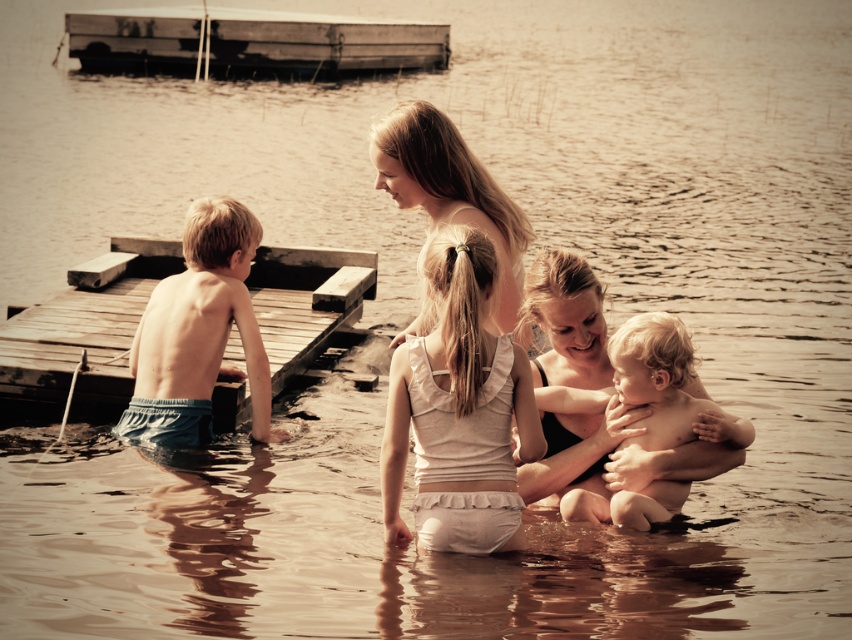
You are a photographer standing at the edge of the lake. You want to take a photo that includes both the blue denim shorts at left and the wooden raft at upper left. Given that your camera has a maximum zoom range of 30 meters, will you be able to capture both objects in the same frame without moving closer?

The blue denim shorts at left and the wooden raft at upper left are 40.17 meters apart from each other. Since the camera can only zoom up to 30 meters, it won not be able to capture both objects in the same frame without moving closer.

You are a photographer trying to capture the blue denim shorts at left and the wooden raft at upper left in the same frame. Based on their positions, which object should you adjust your camera to focus on first to ensure both are in the shot?

The blue denim shorts at left are to the right of the wooden raft at upper left, so you should focus on the wooden raft at upper left first to ensure both are in the frame.

You are a photographer trying to capture the wooden dock at left and the blue denim shorts at left in the same frame. Based on their positions, which object should you focus on first to ensure both are in the frame?

The wooden dock at left is located above the blue denim shorts at left, so you should focus on the wooden dock at left first to ensure both are in the frame.